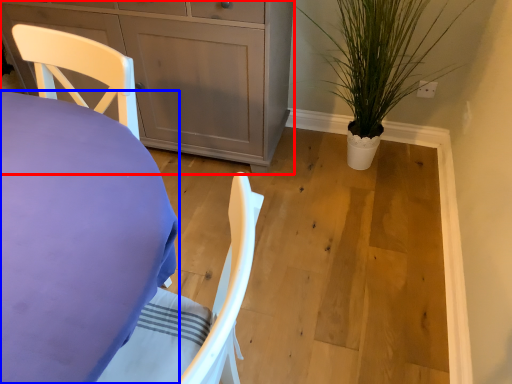
Question: Which point is further to the camera, cabinetry (highlighted by a red box) or desk (highlighted by a blue box)?

Choices:
 (A) cabinetry
 (B) desk

Answer: (A)